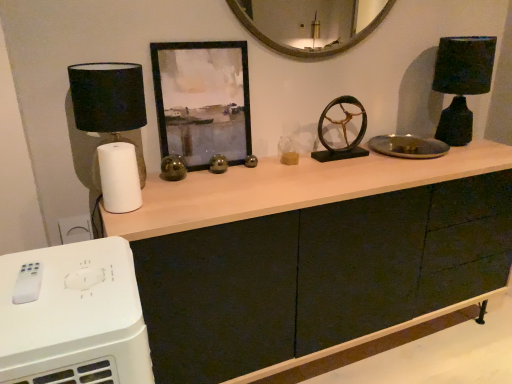
You are a GUI agent. You are given a task and a screenshot of the screen. Output one action in this format:
    pyautogui.click(x=<x>, y=<y>)
    Task: Click on the unoccupied region to the right of black matte picture frame at center
    This screenshot has height=384, width=512.
    Given the screenshot: What is the action you would take?
    [263, 174]